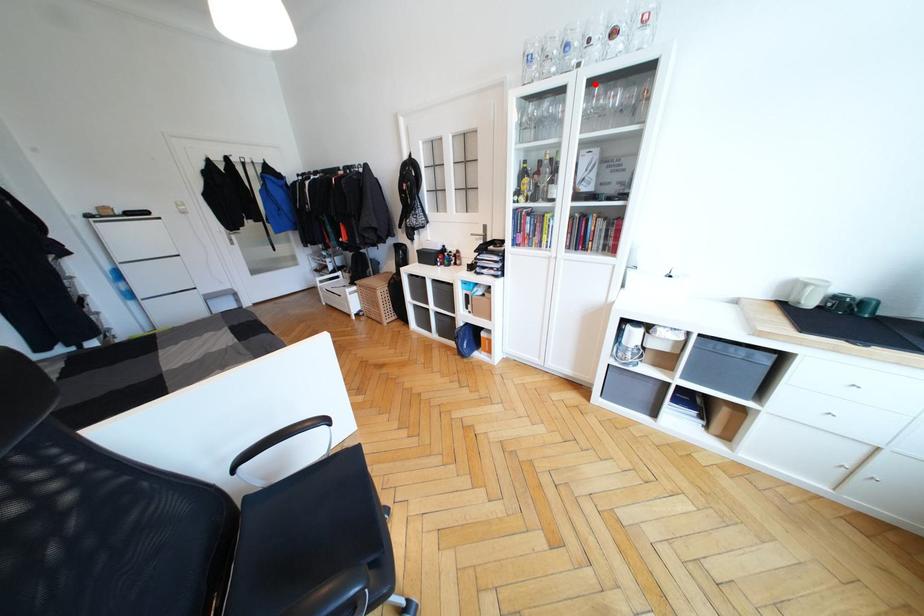
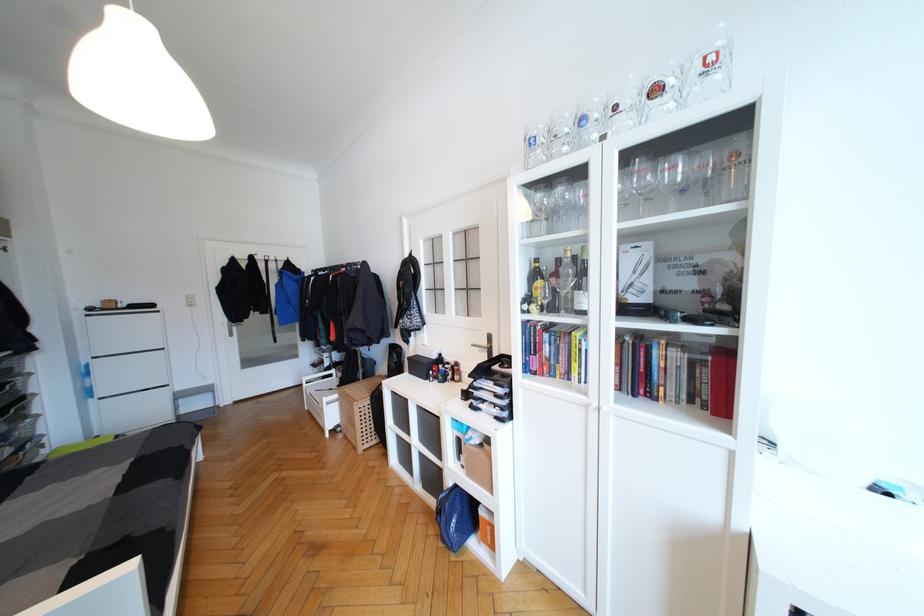
Question: I am providing you with two images of the same scene from different viewpoints. A red point is marked on the first image. Can you still see the location of the red point in image 2?

Choices:
 (A) Yes
 (B) No

Answer: (A)